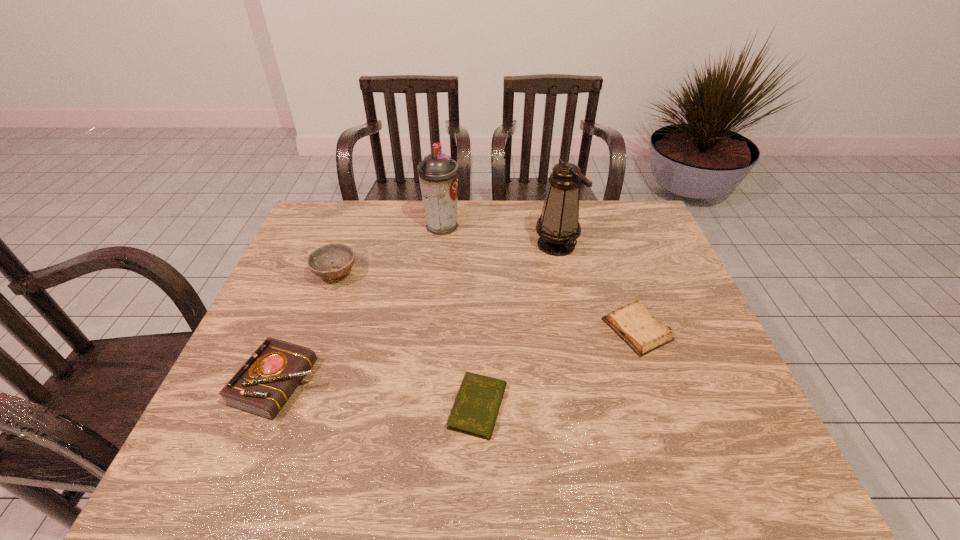
Where is `vacant space at the near edge`? The height and width of the screenshot is (540, 960). vacant space at the near edge is located at coordinates (416, 476).

The height and width of the screenshot is (540, 960). In the image, there is a desktop. What are the coordinates of `free space at the right edge` in the screenshot? It's located at 700,388.

Identify the location of vacant space at the far right corner. This screenshot has height=540, width=960. (637, 219).

Find the location of a particular element. vacant space in between the aerosol can and the leftmost diary is located at coordinates (361, 305).

Where is `empty space between the fifth object from left to right and the leftmost diary`? The height and width of the screenshot is (540, 960). empty space between the fifth object from left to right and the leftmost diary is located at coordinates (419, 314).

At what (x,y) coordinates should I click in order to perform the action: click on free space between the oil lamp and the second shortest object. Please return your answer as a coordinate pair (x, y). The height and width of the screenshot is (540, 960). Looking at the image, I should click on (597, 287).

Where is `unoccupied area between the fifth object from left to right and the shortest diary`? Image resolution: width=960 pixels, height=540 pixels. unoccupied area between the fifth object from left to right and the shortest diary is located at coordinates (517, 326).

Identify the location of free space between the aerosol can and the oil lamp. The height and width of the screenshot is (540, 960). (499, 235).

At what (x,y) coordinates should I click in order to perform the action: click on blank region between the aerosol can and the shortest diary. Please return your answer as a coordinate pair (x, y). The image size is (960, 540). Looking at the image, I should click on (460, 316).

What are the coordinates of `vacant region between the oil lamp and the aerosol can` in the screenshot? It's located at (499, 235).